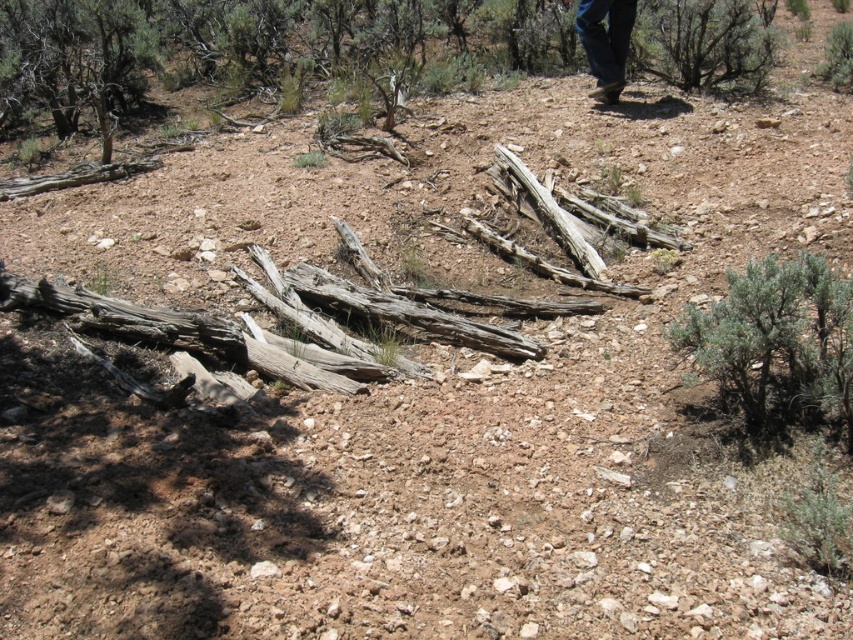
Between green shrub at center right and green leafy bush at upper right, which one appears on the left side from the viewer's perspective?

Positioned to the left is green shrub at center right.

Does green shrub at center right have a smaller size compared to green leafy bush at upper right?

Correct, green shrub at center right occupies less space than green leafy bush at upper right.

Where is `green shrub at center right`? The width and height of the screenshot is (853, 640). green shrub at center right is located at coordinates (776, 340).

Does green shrub at center right have a lesser height compared to brown suede boots at upper right?

Yes.

What do you see at coordinates (776, 340) in the screenshot? This screenshot has height=640, width=853. I see `green shrub at center right` at bounding box center [776, 340].

Where is `green shrub at center right`? Image resolution: width=853 pixels, height=640 pixels. green shrub at center right is located at coordinates (776, 340).

Describe the element at coordinates (704, 42) in the screenshot. Image resolution: width=853 pixels, height=640 pixels. I see `green leafy bush at upper right` at that location.

Who is shorter, green leafy bush at upper right or brown suede boots at upper right?

Standing shorter between the two is brown suede boots at upper right.

Is point (634, 67) positioned in front of point (579, 29)?

No.

Image resolution: width=853 pixels, height=640 pixels. I want to click on green leafy bush at upper right, so click(704, 42).